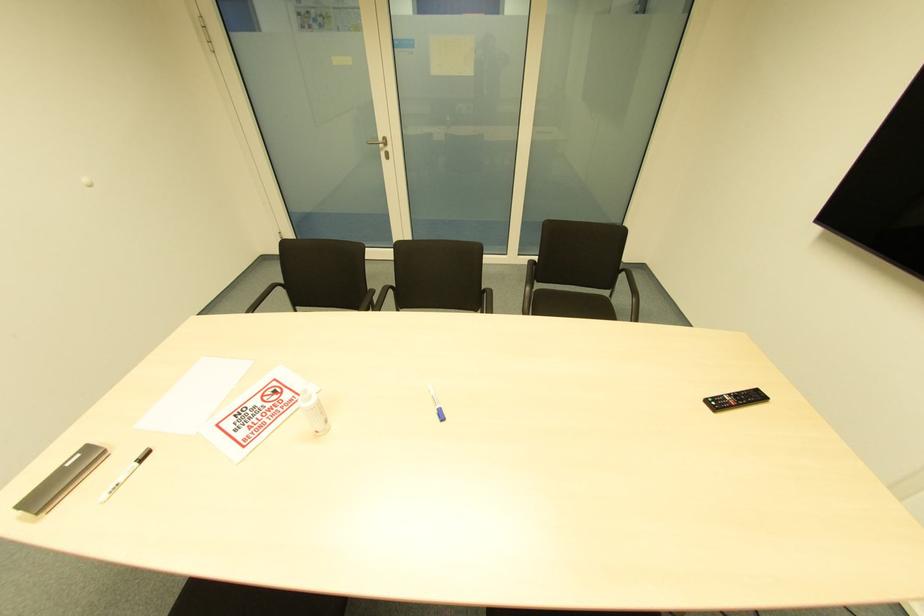
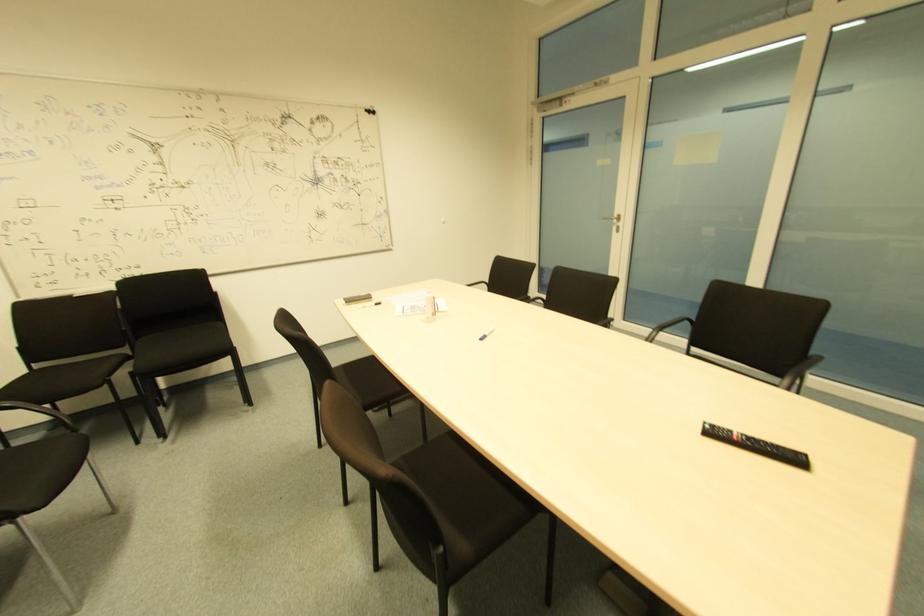
Where in the second image is the point corresponding to point 386,152 from the first image?

(618, 227)